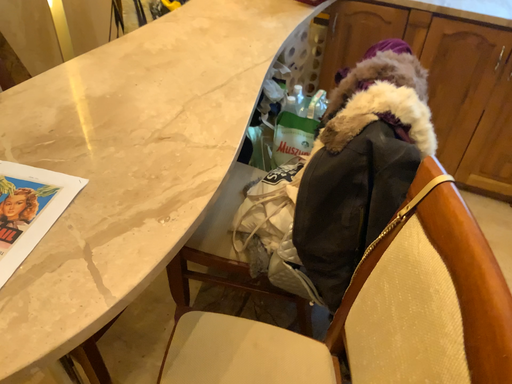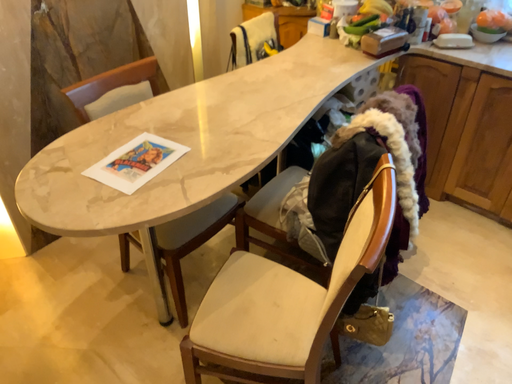
Question: How did the camera likely rotate when shooting the video?

Choices:
 (A) rotated left
 (B) rotated right

Answer: (A)